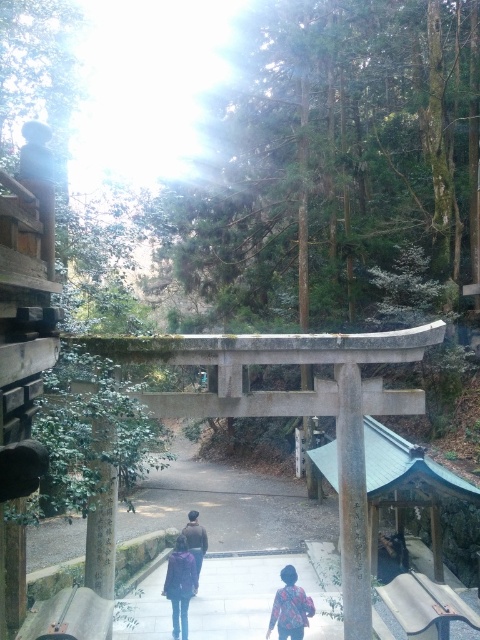
Is the position of smooth gray stone torii gate at center less distant than that of dark brown leather jacket at center?

Yes, smooth gray stone torii gate at center is in front of dark brown leather jacket at center.

Is point (342, 416) behind point (188, 529)?

No, (342, 416) is closer to viewer.

Is point (343, 596) more distant than point (191, 522)?

No, (343, 596) is in front of (191, 522).

Identify the location of smooth gray stone torii gate at center. (352, 504).

Find the location of a particular element. The height and width of the screenshot is (640, 480). matte purple backpack at center is located at coordinates [184, 572].

Which is behind, point (201, 548) or point (194, 561)?

Point (201, 548)

You are a GUI agent. You are given a task and a screenshot of the screen. Output one action in this format:
    pyautogui.click(x=<x>, y=<y>)
    Task: Click on the matte purple backpack at center
    
    Given the screenshot: What is the action you would take?
    pyautogui.click(x=184, y=572)

Does smooth stone path at center have a lesser height compared to floral-patterned shirt at lower center?

Yes, smooth stone path at center is shorter than floral-patterned shirt at lower center.

Does smooth stone path at center lie in front of floral-patterned shirt at lower center?

No, it is behind floral-patterned shirt at lower center.

Is point (312, 541) less distant than point (300, 627)?

That is False.

Locate an element on the screen. This screenshot has height=640, width=480. smooth stone path at center is located at coordinates (261, 593).